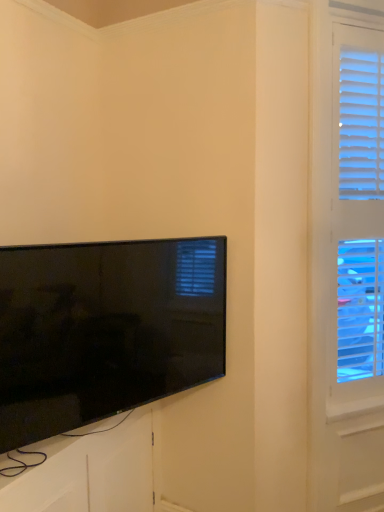
Question: From the image's perspective, is white textured blinds at right located beneath flat-screen tv at lower left?

Choices:
 (A) yes
 (B) no

Answer: (B)

Question: Is white textured blinds at right shorter than flat-screen tv at lower left?

Choices:
 (A) yes
 (B) no

Answer: (B)

Question: Is white textured blinds at right taller than flat-screen tv at lower left?

Choices:
 (A) no
 (B) yes

Answer: (B)

Question: Is white textured blinds at right oriented away from flat-screen tv at lower left?

Choices:
 (A) yes
 (B) no

Answer: (B)

Question: Considering the relative sizes of white textured blinds at right and flat-screen tv at lower left in the image provided, is white textured blinds at right wider than flat-screen tv at lower left?

Choices:
 (A) no
 (B) yes

Answer: (B)

Question: Can you confirm if white textured blinds at right is positioned to the left of flat-screen tv at lower left?

Choices:
 (A) yes
 (B) no

Answer: (B)

Question: From the image's perspective, is flat-screen tv at lower left beneath white textured blinds at right?

Choices:
 (A) no
 (B) yes

Answer: (B)

Question: Considering the relative positions of flat-screen tv at lower left and white textured blinds at right in the image provided, is flat-screen tv at lower left to the right of white textured blinds at right from the viewer's perspective?

Choices:
 (A) no
 (B) yes

Answer: (A)

Question: Does flat-screen tv at lower left come in front of white textured blinds at right?

Choices:
 (A) yes
 (B) no

Answer: (A)

Question: Is flat-screen tv at lower left aimed at white textured blinds at right?

Choices:
 (A) yes
 (B) no

Answer: (B)

Question: Is white textured blinds at right surrounded by flat-screen tv at lower left?

Choices:
 (A) no
 (B) yes

Answer: (A)

Question: Is flat-screen tv at lower left at the left side of white textured blinds at right?

Choices:
 (A) yes
 (B) no

Answer: (A)

Question: From a real-world perspective, is flat-screen tv at lower left positioned above or below white textured blinds at right?

Choices:
 (A) above
 (B) below

Answer: (B)